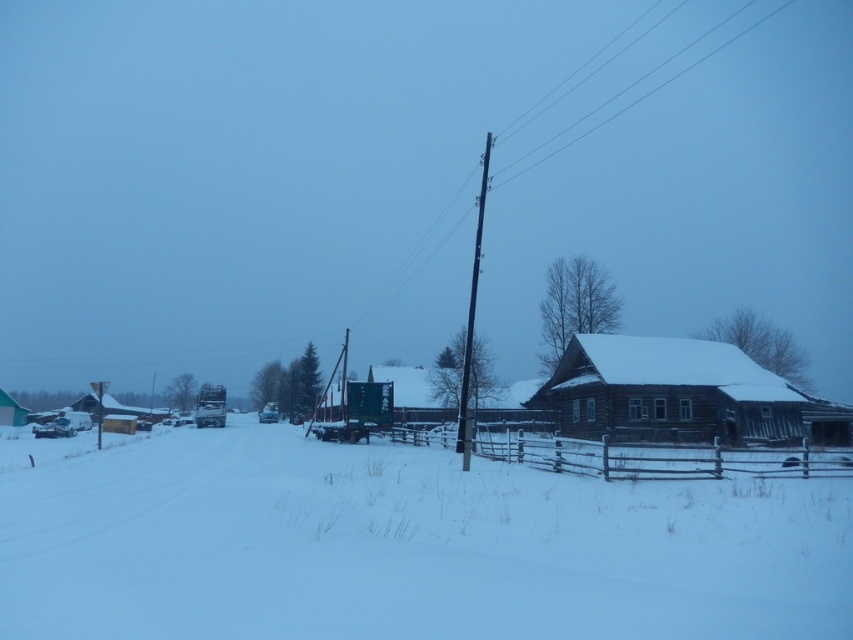
Is wooden cabin at right behind black wooden pole at center?

Yes, it is.

Which of these two, wooden cabin at right or black wooden pole at center, stands taller?

Standing taller between the two is black wooden pole at center.

Is point (694, 339) behind point (459, 392)?

No, it is not.

The image size is (853, 640). In order to click on wooden cabin at right in this screenshot , I will do `click(682, 396)`.

Is white powdery snow at center bigger than wooden cabin at right?

Yes.

Which is in front, point (212, 563) or point (717, 349)?

Point (212, 563) is in front.

Is point (177, 476) positioned before point (703, 394)?

Yes, point (177, 476) is closer to viewer.

Find the location of `white powdery snow at center`. white powdery snow at center is located at coordinates (401, 545).

Which is below, white powdery snow at center or black wooden pole at center?

white powdery snow at center

Who is higher up, white powdery snow at center or black wooden pole at center?

Positioned higher is black wooden pole at center.

Which is behind, point (115, 518) or point (463, 381)?

Positioned behind is point (463, 381).

Find the location of a particular element. The height and width of the screenshot is (640, 853). white powdery snow at center is located at coordinates (401, 545).